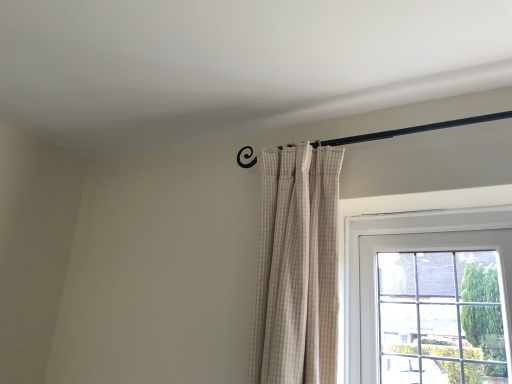
Question: Should I look upward or downward to see beige checkered curtain at upper center?

Choices:
 (A) up
 (B) down

Answer: (B)